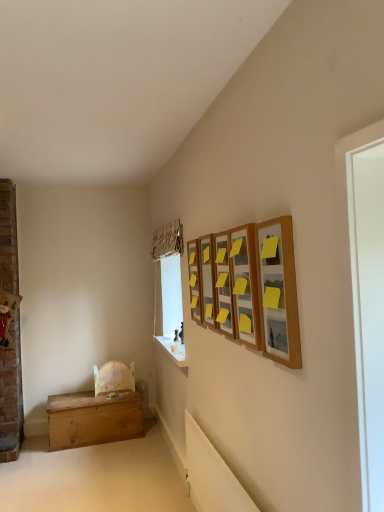
Question: Is wooden chest at lower left positioned beyond the bounds of wooden picture frame at upper center, which is the third picture frame from front to back?

Choices:
 (A) no
 (B) yes

Answer: (B)

Question: From a real-world perspective, is wooden chest at lower left under wooden picture frame at upper center, which is the third picture frame from front to back?

Choices:
 (A) yes
 (B) no

Answer: (A)

Question: Considering the relative sizes of wooden chest at lower left and wooden picture frame at upper center, acting as the 3th picture frame starting from the back, in the image provided, is wooden chest at lower left wider than wooden picture frame at upper center, acting as the 3th picture frame starting from the back,?

Choices:
 (A) no
 (B) yes

Answer: (B)

Question: From the image's perspective, is wooden chest at lower left below wooden picture frame at upper center, which is the third picture frame from front to back?

Choices:
 (A) no
 (B) yes

Answer: (B)

Question: Is wooden chest at lower left in contact with wooden picture frame at upper center, which is the third picture frame from front to back?

Choices:
 (A) yes
 (B) no

Answer: (B)

Question: From the image's perspective, is wooden chest at lower left on wooden picture frame at upper center, acting as the 3th picture frame starting from the back?

Choices:
 (A) yes
 (B) no

Answer: (B)

Question: Is wooden chest at lower left positioned before white smooth window sill at lower center?

Choices:
 (A) no
 (B) yes

Answer: (A)

Question: Considering the relative sizes of wooden chest at lower left and white smooth window sill at lower center in the image provided, is wooden chest at lower left taller than white smooth window sill at lower center?

Choices:
 (A) no
 (B) yes

Answer: (B)

Question: Does wooden chest at lower left have a lesser width compared to white smooth window sill at lower center?

Choices:
 (A) yes
 (B) no

Answer: (B)

Question: From a real-world perspective, is wooden chest at lower left under white smooth window sill at lower center?

Choices:
 (A) yes
 (B) no

Answer: (A)

Question: Considering the relative sizes of wooden chest at lower left and white smooth window sill at lower center in the image provided, is wooden chest at lower left bigger than white smooth window sill at lower center?

Choices:
 (A) yes
 (B) no

Answer: (A)

Question: Does wooden chest at lower left appear on the left side of white smooth window sill at lower center?

Choices:
 (A) yes
 (B) no

Answer: (A)

Question: Does white smooth window sill at lower center appear on the right side of wooden picture frame at upper right, the 2th picture frame viewed from the front?

Choices:
 (A) no
 (B) yes

Answer: (A)